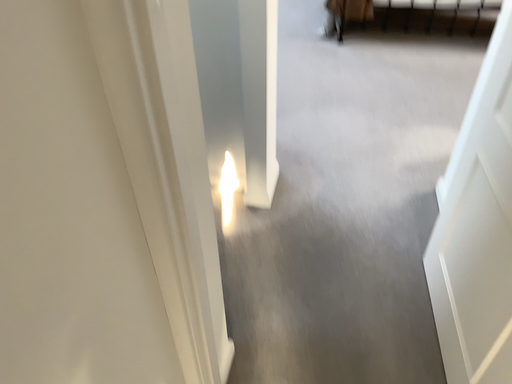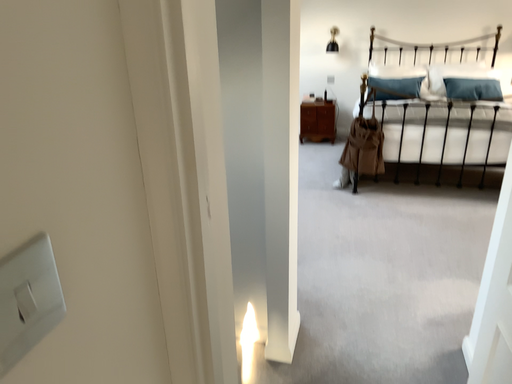
Question: Which way did the camera rotate in the video?

Choices:
 (A) rotated upward
 (B) rotated downward

Answer: (A)